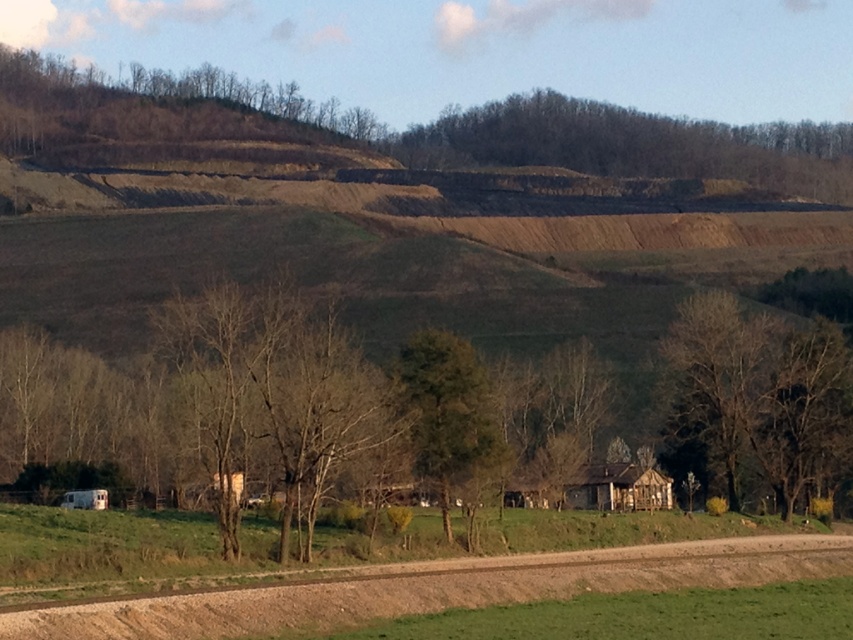
Question: Which point is closer to the camera taking this photo?

Choices:
 (A) (471, 435)
 (B) (706, 384)
 (C) (537, 492)
 (D) (764, 128)

Answer: (A)

Question: Which of these objects is positioned farthest from the brown textured hillside at upper center?

Choices:
 (A) brown textured tree at center
 (B) weathered wood hut at center

Answer: (B)

Question: Where is brown textured hillside at upper center located in relation to green leafy tree at center in the image?

Choices:
 (A) left
 (B) right

Answer: (B)

Question: Which object is farther from the camera taking this photo?

Choices:
 (A) brown textured tree at center
 (B) brown textured hillside at upper center

Answer: (B)

Question: Can you confirm if brown textured hillside at upper center is wider than green leafy tree at center?

Choices:
 (A) yes
 (B) no

Answer: (A)

Question: Can you confirm if green leafy tree at center is smaller than weathered wood hut at center?

Choices:
 (A) yes
 (B) no

Answer: (B)